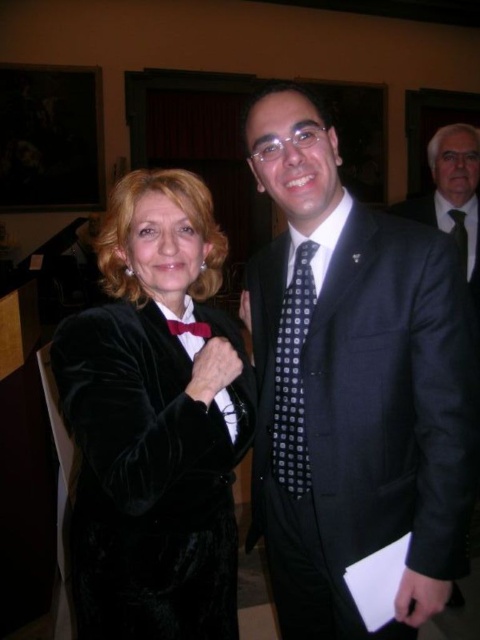
Which is in front, point (302, 394) or point (462, 257)?

Point (302, 394)

Does black dotted tie at center appear under dark blue dotted tie at center?

Yes.

Measure the distance between point (292, 337) and camera.

The distance of point (292, 337) from camera is 3.90 feet.

The image size is (480, 640). In order to click on black dotted tie at center in this screenshot , I will do `click(292, 378)`.

Is velvet black dress at center bigger than dark blue dotted tie at center?

Correct, velvet black dress at center is larger in size than dark blue dotted tie at center.

Which of these two, velvet black dress at center or dark blue dotted tie at center, stands taller?

Standing taller between the two is velvet black dress at center.

Does point (139, 406) come behind point (462, 236)?

No, it is not.

In order to click on velvet black dress at center in this screenshot , I will do `click(155, 420)`.

Which is more to the left, black textured suit at center or black silk suit at center?

black textured suit at center

Can you confirm if black textured suit at center is taller than black silk suit at center?

Correct, black textured suit at center is much taller as black silk suit at center.

In order to click on black textured suit at center in this screenshot , I will do `click(354, 385)`.

Find the location of a particular element. black textured suit at center is located at coordinates (354, 385).